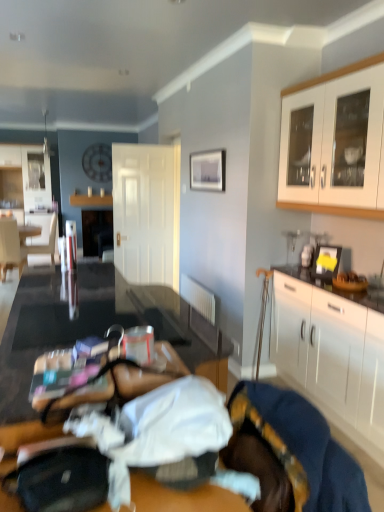
What do you see at coordinates (332, 356) in the screenshot?
I see `white matte cabinet at right, which ranks as the second cabinetry in top-to-bottom order` at bounding box center [332, 356].

You are a GUI agent. You are given a task and a screenshot of the screen. Output one action in this format:
    pyautogui.click(x=<x>, y=<y>)
    Task: Click on the wooden table at lower left
    Image resolution: width=384 pixels, height=512 pixels.
    Given the screenshot: What is the action you would take?
    pyautogui.click(x=120, y=382)

Measure the distance between point (21, 256) and camera.

Point (21, 256) is 5.11 meters away from camera.

What is the approximate height of matte silver picture frame at upper center?

It is 37.88 centimeters.

Describe the element at coordinates (337, 141) in the screenshot. This screenshot has width=384, height=512. I see `white glossy cabinet at upper right, which ranks as the 1th cabinetry in top-to-bottom order` at that location.

Describe the element at coordinates (42, 238) in the screenshot. I see `white fabric armchair at left` at that location.

At what (x,y) coordinates should I click in order to perform the action: click on velvet blue blanket at lower right. Please return your answer as a coordinate pair (x, y). Image resolution: width=384 pixels, height=512 pixels. Looking at the image, I should click on (291, 453).

Identify the location of white matte cabinet at right, the 1th cabinetry when ordered from bottom to top. (332, 356).

Considering the relative sizes of matte silver picture frame at upper center and matte white chair at left in the image provided, is matte silver picture frame at upper center wider than matte white chair at left?

No, matte silver picture frame at upper center is not wider than matte white chair at left.

Consider the image. From the image's perspective, would you say matte silver picture frame at upper center is shown under matte white chair at left?

No, from the image's perspective, matte silver picture frame at upper center is not below matte white chair at left.

Is matte silver picture frame at upper center touching matte white chair at left?

No, matte silver picture frame at upper center is not with matte white chair at left.

How distant is matte silver picture frame at upper center from matte white chair at left?

They are 2.40 meters apart.

Would you say white matte cabinet at right, the 1th cabinetry when ordered from bottom to top, is inside or outside white matte door at center?

white matte cabinet at right, the 1th cabinetry when ordered from bottom to top, is spatially situated outside white matte door at center.

Is white matte cabinet at right, which ranks as the second cabinetry in top-to-bottom order, shorter than white matte door at center?

Correct, white matte cabinet at right, which ranks as the second cabinetry in top-to-bottom order, is not as tall as white matte door at center.

Find the location of a particular element. cabinetry below the white matte door at center (from the image's perspective) is located at coordinates (332, 356).

Considering the sizes of objects white matte cabinet at right, the 1th cabinetry when ordered from bottom to top, and white matte door at center in the image provided, who is bigger, white matte cabinet at right, the 1th cabinetry when ordered from bottom to top, or white matte door at center?

Bigger between the two is white matte cabinet at right, the 1th cabinetry when ordered from bottom to top.

Is velvet blue blanket at lower right inside white matte cabinet at right, which ranks as the second cabinetry in top-to-bottom order?

That's incorrect, velvet blue blanket at lower right is not inside white matte cabinet at right, which ranks as the second cabinetry in top-to-bottom order.

From a real-world perspective, is white matte cabinet at right, the 1th cabinetry when ordered from bottom to top, on velvet blue blanket at lower right?

No.

Is point (294, 315) farther from viewer compared to point (244, 417)?

Yes, it is behind point (244, 417).

Is white matte cabinet at right, which ranks as the second cabinetry in top-to-bottom order, wider or thinner than velvet blue blanket at lower right?

white matte cabinet at right, which ranks as the second cabinetry in top-to-bottom order, is wider than velvet blue blanket at lower right.

Is white matte cabinet at right, which ranks as the second cabinetry in top-to-bottom order, facing away from wooden table at lower left?

That's not correct — white matte cabinet at right, which ranks as the second cabinetry in top-to-bottom order, is not looking away from wooden table at lower left.

Can wooden table at lower left be found inside white matte cabinet at right, the 1th cabinetry when ordered from bottom to top?

No, white matte cabinet at right, the 1th cabinetry when ordered from bottom to top, does not contain wooden table at lower left.

Between white matte cabinet at right, which ranks as the second cabinetry in top-to-bottom order, and wooden table at lower left, which one has more height?

white matte cabinet at right, which ranks as the second cabinetry in top-to-bottom order.

Does white matte cabinet at right, the 1th cabinetry when ordered from bottom to top, lie behind wooden table at lower left?

Yes, the depth of white matte cabinet at right, the 1th cabinetry when ordered from bottom to top, is greater than that of wooden table at lower left.

Considering the relative positions of matte silver picture frame at upper center and white fabric armchair at left in the image provided, is matte silver picture frame at upper center to the right of white fabric armchair at left from the viewer's perspective?

Yes.

Would you say matte silver picture frame at upper center contains white fabric armchair at left?

That's incorrect, white fabric armchair at left is not inside matte silver picture frame at upper center.

Is matte silver picture frame at upper center next to white fabric armchair at left?

matte silver picture frame at upper center and white fabric armchair at left are clearly separated.

What are the coordinates of `picture frame in front of the white fabric armchair at left` in the screenshot? It's located at (208, 170).

Is matte white chair at left at the left side of white fabric bed at lower center?

Yes, matte white chair at left is to the left of white fabric bed at lower center.

Which object is thinner, matte white chair at left or white fabric bed at lower center?

white fabric bed at lower center.

What's the angular difference between matte white chair at left and white fabric bed at lower center's facing directions?

99.1 degrees separate the facing orientations of matte white chair at left and white fabric bed at lower center.

Is matte white chair at left in front of or behind white fabric bed at lower center in the image?

Clearly, matte white chair at left is behind white fabric bed at lower center.

Does point (262, 476) come farther from viewer compared to point (129, 386)?

No, it is not.

Is velvet blue blanket at lower right oriented towards wooden table at lower left?

Yes, velvet blue blanket at lower right is facing wooden table at lower left.

Which object is thinner, velvet blue blanket at lower right or wooden table at lower left?

Thinner between the two is wooden table at lower left.

Where is `chair behind the matte silver picture frame at upper center`? This screenshot has height=512, width=384. chair behind the matte silver picture frame at upper center is located at coordinates (10, 248).

In the image, there is a white matte door at center. Where is `cabinetry below it (from a real-world perspective)`? Image resolution: width=384 pixels, height=512 pixels. cabinetry below it (from a real-world perspective) is located at coordinates pos(332,356).

In the scene shown: Which object lies further to the anchor point white glossy cabinet at upper right, which ranks as the 1th cabinetry in top-to-bottom order, matte white chair at left or velvet blue blanket at lower right?

Based on the image, matte white chair at left appears to be further to white glossy cabinet at upper right, which ranks as the 1th cabinetry in top-to-bottom order.

Consider the image. Looking at the image, which one is located closer to white fabric armchair at left, wooden table at lower left or matte white chair at left?

matte white chair at left.

Consider the image. Based on their spatial positions, is white glossy cabinet at upper right, acting as the second cabinetry starting from the bottom, or matte white chair at left closer to white fabric armchair at left?

The object closer to white fabric armchair at left is matte white chair at left.

From the image, which object appears to be nearer to white matte cabinet at right, the 1th cabinetry when ordered from bottom to top, white fabric bed at lower center or white glossy cabinet at upper right, which ranks as the 1th cabinetry in top-to-bottom order?

white glossy cabinet at upper right, which ranks as the 1th cabinetry in top-to-bottom order, is closer to white matte cabinet at right, the 1th cabinetry when ordered from bottom to top.

Estimate the real-world distances between objects in this image. Which object is closer to white fabric bed at lower center, wooden table at lower left or white matte door at center?

Among the two, wooden table at lower left is located nearer to white fabric bed at lower center.

Estimate the real-world distances between objects in this image. Which object is closer to matte white chair at left, wooden table at lower left or white matte cabinet at right, which ranks as the second cabinetry in top-to-bottom order?

Based on the image, white matte cabinet at right, which ranks as the second cabinetry in top-to-bottom order, appears to be nearer to matte white chair at left.

From the image, which object appears to be farther from white matte door at center, white matte cabinet at right, which ranks as the second cabinetry in top-to-bottom order, or wooden table at lower left?

wooden table at lower left.

Which object lies nearer to the anchor point white matte door at center, matte white chair at left or wooden table at lower left?

Based on the image, matte white chair at left appears to be nearer to white matte door at center.

The image size is (384, 512). I want to click on chair between white glossy cabinet at upper right, which ranks as the 1th cabinetry in top-to-bottom order, and white fabric armchair at left, along the z-axis, so click(x=10, y=248).

This screenshot has height=512, width=384. What are the coordinates of `bed situated between wooden table at lower left and white glossy cabinet at upper right, which ranks as the 1th cabinetry in top-to-bottom order, from left to right` in the screenshot? It's located at (296, 453).

You are a GUI agent. You are given a task and a screenshot of the screen. Output one action in this format:
    pyautogui.click(x=<x>, y=<y>)
    Task: Click on the door between white fabric bed at lower center and white fabric armchair at left from front to back
    The width and height of the screenshot is (384, 512).
    Given the screenshot: What is the action you would take?
    pyautogui.click(x=146, y=212)

Locate an element on the screen. The height and width of the screenshot is (512, 384). bed between white glossy cabinet at upper right, acting as the second cabinetry starting from the bottom, and velvet blue blanket at lower right vertically is located at coordinates (296, 453).